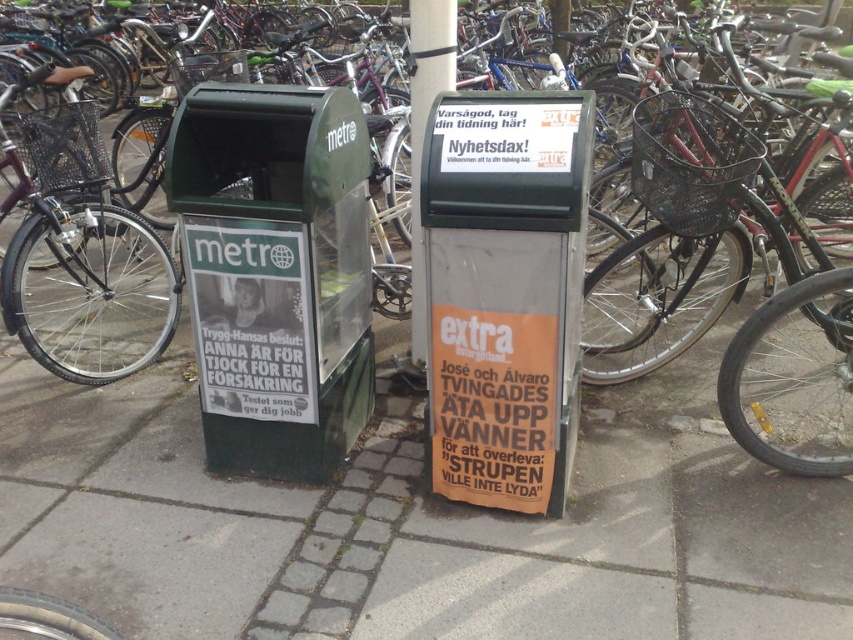
You are a delivery person who needs to park your shiny black bicycle at left near the camera. Given that the camera is placed 9.68 feet away from the bicycle, can you safely park the bicycle within 10 feet of the camera without moving it?

The shiny black bicycle at left and camera are 9.68 feet apart, so yes, you can safely park the bicycle within 10 feet of the camera without moving it.

You are a delivery person standing between the black wire basket at right and the shiny black bicycle at left. You need to pick up the basket first. Which object should you move towards?

The black wire basket at right is closer to the viewer than the shiny black bicycle at left, so you should move towards the black wire basket at right first.

You are standing in front of the two newspaper vending machines. There are two points marked on the machines. The first point is at coordinate point (125, 259) and the second is at point (451, 58). Which point is closer to you?

Point (125, 259) is further to the camera than point (451, 58), so the point closer to you is point (451, 58).